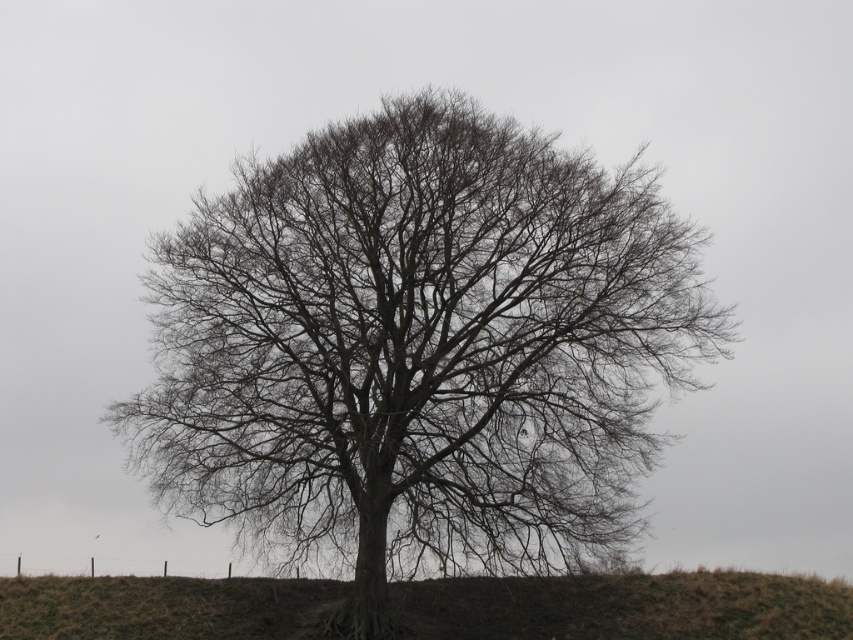
Question: Which of the following is the closest to the observer?

Choices:
 (A) bare branches at center
 (B) brown grassy hillside at center

Answer: (B)

Question: Which point appears farthest from the camera in this image?

Choices:
 (A) (276, 362)
 (B) (231, 589)

Answer: (B)

Question: Can you confirm if bare branches at center is bigger than brown grassy hillside at center?

Choices:
 (A) no
 (B) yes

Answer: (B)

Question: In this image, where is bare branches at center located relative to brown grassy hillside at center?

Choices:
 (A) right
 (B) left

Answer: (B)

Question: Is bare branches at center wider than brown grassy hillside at center?

Choices:
 (A) no
 (B) yes

Answer: (A)